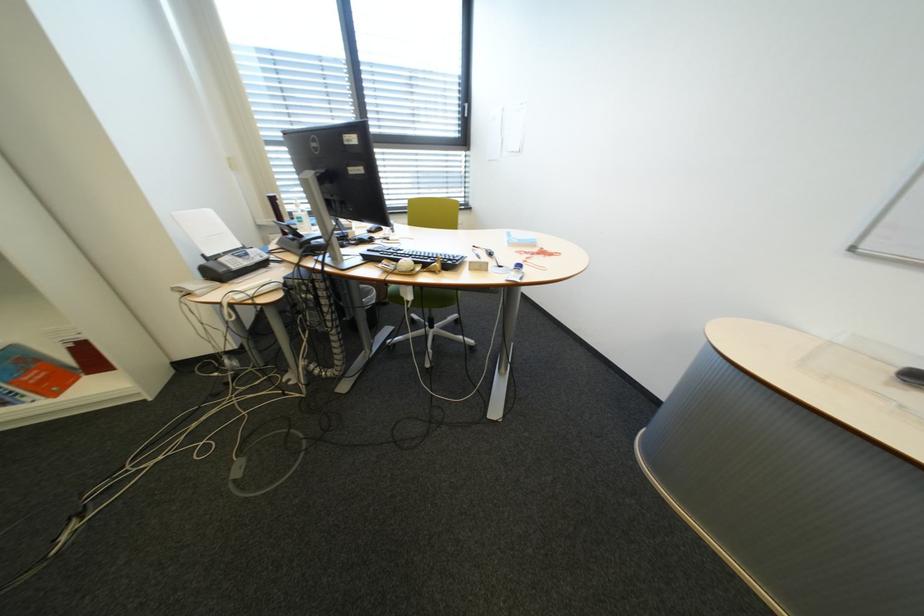
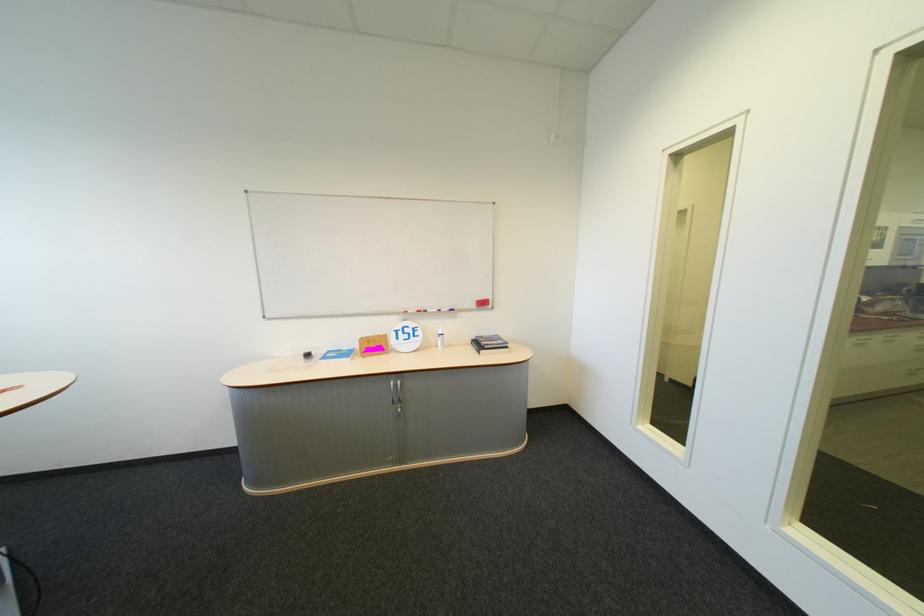
Question: The camera is either moving clockwise (left) or counter-clockwise (right) around the object. The first image is from the beginning of the video and the second image is from the end. Is the camera moving left or right when shooting the video?

Choices:
 (A) Left
 (B) Right

Answer: (A)